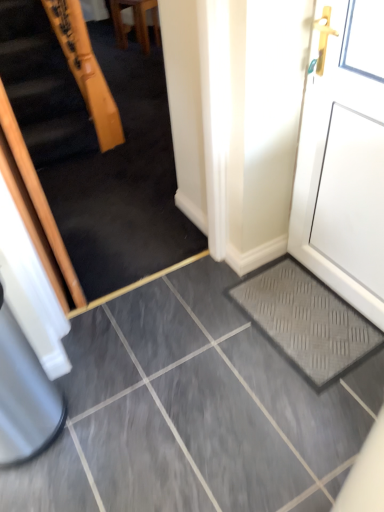
Question: From the image's perspective, is white matte door at right located above or below wooden handrail at upper left?

Choices:
 (A) above
 (B) below

Answer: (B)

Question: Relative to wooden handrail at upper left, is white matte door at right in front or behind?

Choices:
 (A) front
 (B) behind

Answer: (A)

Question: Considering the real-world distances, which object is farthest from the wooden chair at upper center?

Choices:
 (A) wooden handrail at upper left
 (B) white matte door at right
 (C) grey rubber doormat at lower right

Answer: (C)

Question: Based on their relative distances, which object is farther from the wooden chair at upper center?

Choices:
 (A) wooden handrail at upper left
 (B) grey rubber doormat at lower right
 (C) white matte door at right

Answer: (B)